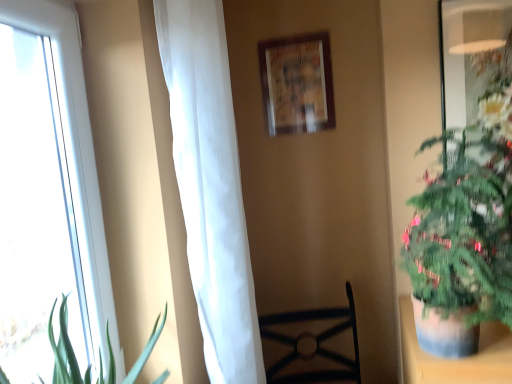
The width and height of the screenshot is (512, 384). I want to click on white sheer curtain at left, so click(x=210, y=185).

Measure the distance between white sheer curtain at left and camera.

The distance of white sheer curtain at left from camera is 3.33 feet.

Describe the element at coordinates (315, 344) in the screenshot. I see `black metal chair at center` at that location.

You are a GUI agent. You are given a task and a screenshot of the screen. Output one action in this format:
    pyautogui.click(x=<x>, y=<y>)
    Task: Click on the white sheer curtain at left
    The width and height of the screenshot is (512, 384).
    Given the screenshot: What is the action you would take?
    pyautogui.click(x=210, y=185)

From a real-world perspective, does black metal chair at center stand above wooden picture frame at upper center?

No, from a real-world perspective, black metal chair at center is not above wooden picture frame at upper center.

Is black metal chair at center aimed at wooden picture frame at upper center?

No, black metal chair at center is not aimed at wooden picture frame at upper center.

Does black metal chair at center have a greater height compared to wooden picture frame at upper center?

Indeed, black metal chair at center has a greater height compared to wooden picture frame at upper center.

From the image's perspective, which one is positioned lower, white sheer curtain at left or wooden picture frame at upper center?

white sheer curtain at left appears lower in the image.

Is white sheer curtain at left behind wooden picture frame at upper center?

No, white sheer curtain at left is in front of wooden picture frame at upper center.

Can you tell me how much white sheer curtain at left and green leafy plant at right differ in facing direction?

They differ by 90 degrees in their facing directions.

Is white sheer curtain at left aimed at green leafy plant at right?

Yes, white sheer curtain at left is oriented towards green leafy plant at right.

Considering their positions, is white sheer curtain at left located in front of or behind green leafy plant at right?

white sheer curtain at left is positioned farther from the viewer than green leafy plant at right.

Is black metal chair at center positioned with its back to white glass window at left?

That's not correct — black metal chair at center is not looking away from white glass window at left.

Is black metal chair at center far away from white glass window at left?

black metal chair at center is actually quite close to white glass window at left.

Can you confirm if black metal chair at center is bigger than white glass window at left?

Correct, black metal chair at center is larger in size than white glass window at left.

From a real-world perspective, does black metal chair at center sit lower than white glass window at left?

Correct, in the physical world, black metal chair at center is lower than white glass window at left.

Considering the sizes of objects white glass window at left and white sheer curtain at left in the image provided, who is bigger, white glass window at left or white sheer curtain at left?

white sheer curtain at left.

Is white glass window at left positioned in front of white sheer curtain at left?

Yes, it is in front of white sheer curtain at left.

Is white glass window at left to the left of white sheer curtain at left from the viewer's perspective?

Indeed, white glass window at left is positioned on the left side of white sheer curtain at left.

Would you say wooden picture frame at upper center is to the left or to the right of white glass window at left in the picture?

From the image, it's evident that wooden picture frame at upper center is to the right of white glass window at left.

Is wooden picture frame at upper center turned away from white glass window at left?

wooden picture frame at upper center does not have its back to white glass window at left.

From the image's perspective, is wooden picture frame at upper center above or below white glass window at left?

Based on their image positions, wooden picture frame at upper center is located above white glass window at left.

Considering the sizes of green leafy plant at right and white sheer curtain at left in the image, is green leafy plant at right wider or thinner than white sheer curtain at left?

Considering their sizes, green leafy plant at right looks broader than white sheer curtain at left.

Considering the relative positions of green leafy plant at right and white sheer curtain at left in the image provided, is green leafy plant at right behind white sheer curtain at left?

No.

How different are the orientations of green leafy plant at right and white sheer curtain at left in degrees?

The facing directions of green leafy plant at right and white sheer curtain at left are 90 degrees apart.

This screenshot has height=384, width=512. What are the coordinates of `picture frame located on the left of black metal chair at center` in the screenshot? It's located at (297, 83).

The image size is (512, 384). Identify the location of picture frame above the white sheer curtain at left (from a real-world perspective). (297, 83).

Which object lies nearer to the anchor point white sheer curtain at left, wooden picture frame at upper center or black metal chair at center?

wooden picture frame at upper center is positioned closer to the anchor white sheer curtain at left.

Looking at the image, which one is located further to white glass window at left, white sheer curtain at left or black metal chair at center?

black metal chair at center is further to white glass window at left.

Based on their spatial positions, is black metal chair at center or white sheer curtain at left closer to white glass window at left?

Based on the image, white sheer curtain at left appears to be nearer to white glass window at left.

From the image, which object appears to be farther from white sheer curtain at left, white glass window at left or wooden picture frame at upper center?

wooden picture frame at upper center is positioned further to the anchor white sheer curtain at left.

Considering their positions, is black metal chair at center positioned closer to white sheer curtain at left than green leafy plant at right?

The object closer to white sheer curtain at left is green leafy plant at right.

Which object lies nearer to the anchor point green leafy plant at right, wooden picture frame at upper center or black metal chair at center?

The object closer to green leafy plant at right is wooden picture frame at upper center.

Estimate the real-world distances between objects in this image. Which object is further from wooden picture frame at upper center, white sheer curtain at left or black metal chair at center?

Based on the image, black metal chair at center appears to be further to wooden picture frame at upper center.

When comparing their distances from green leafy plant at right, does white sheer curtain at left or white glass window at left seem closer?

Based on the image, white sheer curtain at left appears to be nearer to green leafy plant at right.

At what (x,y) coordinates should I click in order to perform the action: click on curtain positioned between white glass window at left and wooden picture frame at upper center from near to far. Please return your answer as a coordinate pair (x, y). Looking at the image, I should click on (x=210, y=185).

Image resolution: width=512 pixels, height=384 pixels. Find the location of `curtain between green leafy plant at right and wooden picture frame at upper center in the front-back direction`. curtain between green leafy plant at right and wooden picture frame at upper center in the front-back direction is located at coordinates (210, 185).

You are a GUI agent. You are given a task and a screenshot of the screen. Output one action in this format:
    pyautogui.click(x=<x>, y=<y>)
    Task: Click on the houseplant between wooden picture frame at upper center and black metal chair at center in the up-down direction
    This screenshot has height=384, width=512.
    Given the screenshot: What is the action you would take?
    pyautogui.click(x=465, y=225)

Image resolution: width=512 pixels, height=384 pixels. I want to click on curtain between white glass window at left and green leafy plant at right in the horizontal direction, so click(x=210, y=185).